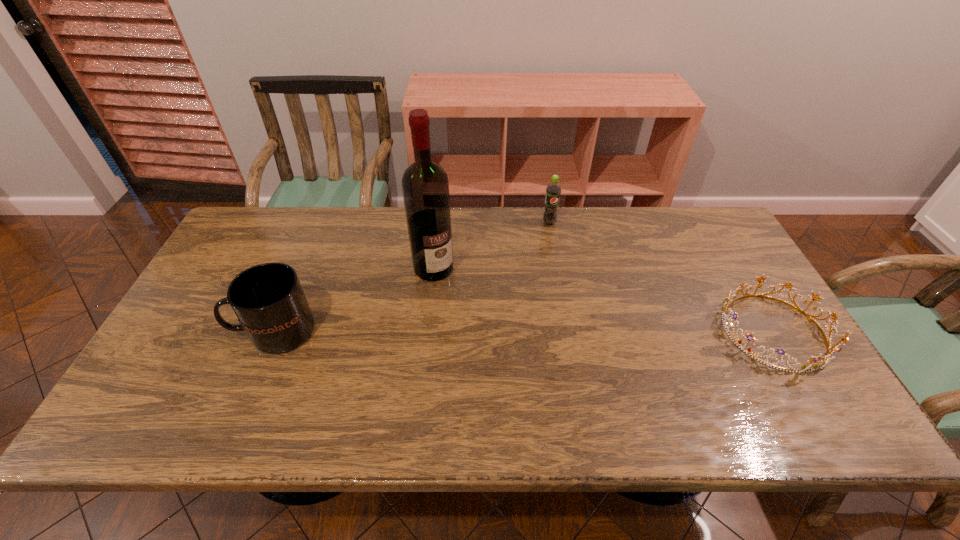
Locate an element on the screen. This screenshot has height=540, width=960. the leftmost object is located at coordinates (268, 300).

The width and height of the screenshot is (960, 540). I want to click on the shortest object, so click(811, 366).

In order to click on the rightmost object in this screenshot , I will do `click(811, 366)`.

Image resolution: width=960 pixels, height=540 pixels. Find the location of `the second object from right to left`. the second object from right to left is located at coordinates (553, 190).

Locate an element on the screen. The image size is (960, 540). the farthest object is located at coordinates (553, 190).

The height and width of the screenshot is (540, 960). I want to click on the tallest object, so click(425, 185).

Find the location of a particular element. This screenshot has height=540, width=960. the second farthest object is located at coordinates (425, 185).

Locate an element on the screen. Image resolution: width=960 pixels, height=540 pixels. vacant space located 0.160m with the handle on the side of the mug is located at coordinates (174, 331).

The width and height of the screenshot is (960, 540). Find the location of `free region located 0.060m with the handle on the side of the mug`. free region located 0.060m with the handle on the side of the mug is located at coordinates (212, 331).

Locate an element on the screen. This screenshot has height=540, width=960. vacant space situated 0.110m with the handle on the side of the mug is located at coordinates (193, 331).